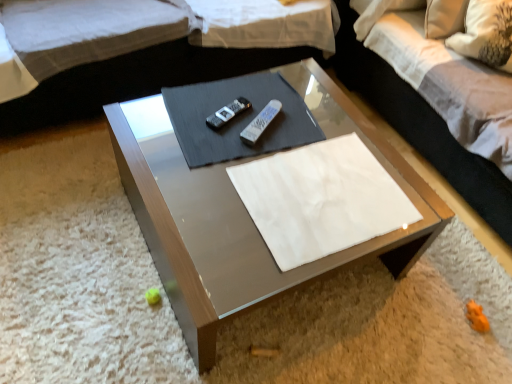
Find the location of `unoccupied area in front of black plastic remote at center, arranged as the second remote when viewed from the right`. unoccupied area in front of black plastic remote at center, arranged as the second remote when viewed from the right is located at coordinates (222, 150).